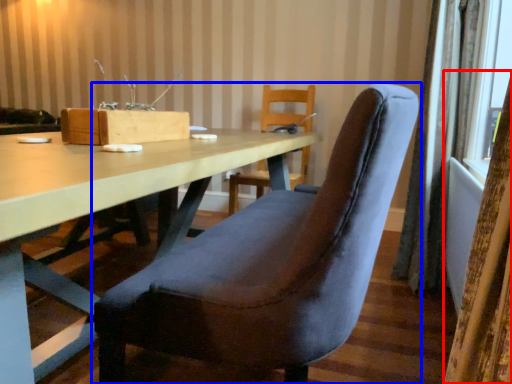
Question: Which object is further to the camera taking this photo, curtain (highlighted by a red box) or chair (highlighted by a blue box)?

Choices:
 (A) curtain
 (B) chair

Answer: (B)